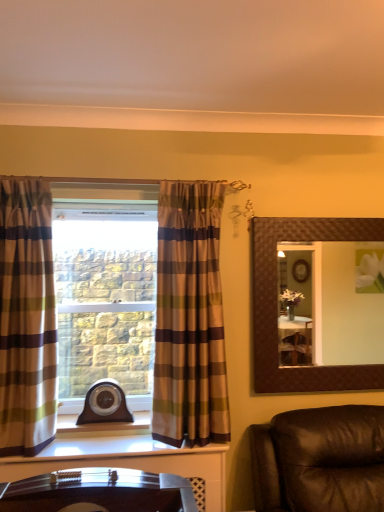
In order to face plaid fabric curtain at left, positioned as the 1th curtain in right-to-left order, should I rotate leftwards or rightwards?

A 0.515 degree turn to the left will do.

Image resolution: width=384 pixels, height=512 pixels. I want to click on plaid fabric curtain at left, which is the 2th curtain in left-to-right order, so click(x=189, y=318).

Find the location of a particular element. This screenshot has height=512, width=384. curtain lying in front of the plaid fabric curtain at left, which is the 2th curtain in left-to-right order is located at coordinates (27, 318).

Consider the image. Does plaid fabric curtain at left, positioned as the 1th curtain in right-to-left order, appear on the right side of plaid fabric curtain at left, the first curtain from the left?

Indeed, plaid fabric curtain at left, positioned as the 1th curtain in right-to-left order, is positioned on the right side of plaid fabric curtain at left, the first curtain from the left.

Can you confirm if plaid fabric curtain at left, positioned as the 1th curtain in right-to-left order, is wider than plaid fabric curtain at left, the 2th curtain positioned from the right?

Incorrect, the width of plaid fabric curtain at left, positioned as the 1th curtain in right-to-left order, does not surpass that of plaid fabric curtain at left, the 2th curtain positioned from the right.

Does plaid fabric curtain at left, which is the 2th curtain in left-to-right order, contain plaid fabric curtain at left, the first curtain from the left?

That's incorrect, plaid fabric curtain at left, the first curtain from the left, is not inside plaid fabric curtain at left, which is the 2th curtain in left-to-right order.

Is plaid fabric curtain at left, the first curtain from the left, oriented away from brown textured mirror at upper right?

No.

Find the location of `mirror on the right of plaid fabric curtain at left, the 2th curtain positioned from the right`. mirror on the right of plaid fabric curtain at left, the 2th curtain positioned from the right is located at coordinates (346, 309).

Based on their sizes in the image, would you say plaid fabric curtain at left, the 2th curtain positioned from the right, is bigger or smaller than brown textured mirror at upper right?

Considering their sizes, plaid fabric curtain at left, the 2th curtain positioned from the right, takes up more space than brown textured mirror at upper right.

From a real-world perspective, between brown textured mirror at upper right and plaid fabric curtain at left, the 2th curtain positioned from the right, who is vertically lower?

From a 3D spatial view, brown textured mirror at upper right is below.

Based on the photo, is brown textured mirror at upper right next to plaid fabric curtain at left, the first curtain from the left, and touching it?

brown textured mirror at upper right and plaid fabric curtain at left, the first curtain from the left, are clearly separated.

Is brown textured mirror at upper right facing towards plaid fabric curtain at left, the first curtain from the left?

No, brown textured mirror at upper right is not oriented towards plaid fabric curtain at left, the first curtain from the left.

What's the angular difference between brown textured mirror at upper right and plaid fabric curtain at left, the first curtain from the left,'s facing directions?

There is a 5.48-degree angle between the facing directions of brown textured mirror at upper right and plaid fabric curtain at left, the first curtain from the left.

Considering the sizes of objects brown textured mirror at upper right and plaid fabric curtain at left, which is the 2th curtain in left-to-right order, in the image provided, who is smaller, brown textured mirror at upper right or plaid fabric curtain at left, which is the 2th curtain in left-to-right order,?

brown textured mirror at upper right.

Could plaid fabric curtain at left, which is the 2th curtain in left-to-right order, be considered to be inside brown textured mirror at upper right?

No, plaid fabric curtain at left, which is the 2th curtain in left-to-right order, is not a part of brown textured mirror at upper right.

Locate an element on the screen. mirror above the plaid fabric curtain at left, which is the 2th curtain in left-to-right order (from the image's perspective) is located at coordinates (346, 309).

Considering the relative sizes of plaid fabric curtain at left, which is the 2th curtain in left-to-right order, and brown textured mirror at upper right in the image provided, is plaid fabric curtain at left, which is the 2th curtain in left-to-right order, shorter than brown textured mirror at upper right?

Incorrect, the height of plaid fabric curtain at left, which is the 2th curtain in left-to-right order, does not fall short of that of brown textured mirror at upper right.

Does plaid fabric curtain at left, positioned as the 1th curtain in right-to-left order, lie behind brown textured mirror at upper right?

No, it is not.

Between point (197, 260) and point (372, 319), which one is positioned behind?

The point (372, 319) is behind.

From a real-world perspective, who is located lower, plaid fabric curtain at left, positioned as the 1th curtain in right-to-left order, or brown textured mirror at upper right?

plaid fabric curtain at left, positioned as the 1th curtain in right-to-left order.

Is plaid fabric curtain at left, the first curtain from the left, not close to plaid fabric curtain at left, positioned as the 1th curtain in right-to-left order?

No, there isn't a large distance between plaid fabric curtain at left, the first curtain from the left, and plaid fabric curtain at left, positioned as the 1th curtain in right-to-left order.

Looking at their sizes, would you say plaid fabric curtain at left, the first curtain from the left, is wider or thinner than plaid fabric curtain at left, which is the 2th curtain in left-to-right order?

In the image, plaid fabric curtain at left, the first curtain from the left, appears to be wider than plaid fabric curtain at left, which is the 2th curtain in left-to-right order.

Which is more to the left, plaid fabric curtain at left, the first curtain from the left, or plaid fabric curtain at left, which is the 2th curtain in left-to-right order?

Positioned to the left is plaid fabric curtain at left, the first curtain from the left.

Which of these two, plaid fabric curtain at left, the first curtain from the left, or plaid fabric curtain at left, which is the 2th curtain in left-to-right order, is bigger?

plaid fabric curtain at left, which is the 2th curtain in left-to-right order.

This screenshot has width=384, height=512. I want to click on curtain located underneath the plaid fabric curtain at left, the 2th curtain positioned from the right (from a real-world perspective), so click(x=189, y=318).

Where is `mirror behind the plaid fabric curtain at left, the 2th curtain positioned from the right`? mirror behind the plaid fabric curtain at left, the 2th curtain positioned from the right is located at coordinates (346, 309).

Considering their positions, is plaid fabric curtain at left, positioned as the 1th curtain in right-to-left order, positioned closer to plaid fabric curtain at left, the 2th curtain positioned from the right, than brown textured mirror at upper right?

Based on the image, plaid fabric curtain at left, positioned as the 1th curtain in right-to-left order, appears to be nearer to plaid fabric curtain at left, the 2th curtain positioned from the right.

Considering their positions, is brown textured mirror at upper right positioned further to plaid fabric curtain at left, the first curtain from the left, than plaid fabric curtain at left, positioned as the 1th curtain in right-to-left order?

brown textured mirror at upper right is further to plaid fabric curtain at left, the first curtain from the left.

From the image, which object appears to be nearer to brown textured mirror at upper right, plaid fabric curtain at left, which is the 2th curtain in left-to-right order, or plaid fabric curtain at left, the 2th curtain positioned from the right?

Based on the image, plaid fabric curtain at left, which is the 2th curtain in left-to-right order, appears to be nearer to brown textured mirror at upper right.

Looking at the image, which one is located closer to plaid fabric curtain at left, positioned as the 1th curtain in right-to-left order, brown textured mirror at upper right or plaid fabric curtain at left, the first curtain from the left?

plaid fabric curtain at left, the first curtain from the left.

Which object lies nearer to the anchor point plaid fabric curtain at left, positioned as the 1th curtain in right-to-left order, plaid fabric curtain at left, the 2th curtain positioned from the right, or brown textured mirror at upper right?

Based on the image, plaid fabric curtain at left, the 2th curtain positioned from the right, appears to be nearer to plaid fabric curtain at left, positioned as the 1th curtain in right-to-left order.

Looking at this image, which object lies further to the anchor point brown textured mirror at upper right, plaid fabric curtain at left, the 2th curtain positioned from the right, or plaid fabric curtain at left, which is the 2th curtain in left-to-right order?

→ Among the two, plaid fabric curtain at left, the 2th curtain positioned from the right, is located further to brown textured mirror at upper right.

Where is `curtain located between plaid fabric curtain at left, the first curtain from the left, and brown textured mirror at upper right in the left-right direction`? curtain located between plaid fabric curtain at left, the first curtain from the left, and brown textured mirror at upper right in the left-right direction is located at coordinates (189, 318).